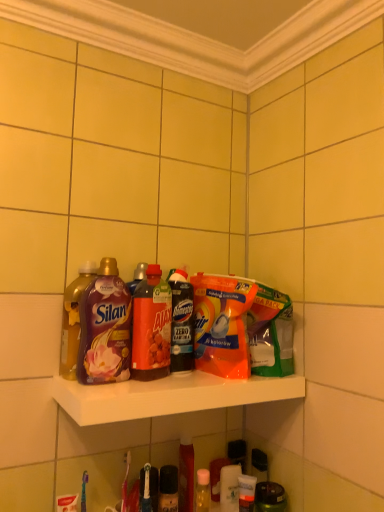
You are a GUI agent. You are given a task and a screenshot of the screen. Output one action in this format:
    pyautogui.click(x=<x>, y=<y>)
    Task: Click on the free space in front of orange plastic dishwashing liquid at center
    The height and width of the screenshot is (512, 384).
    Given the screenshot: What is the action you would take?
    pyautogui.click(x=187, y=382)